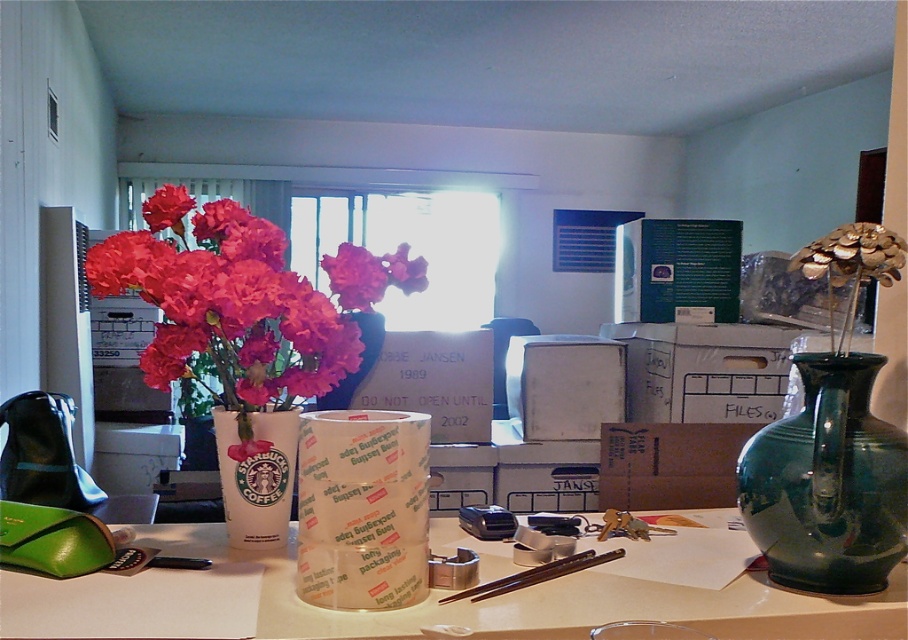
You are standing in the storage room and looking at the table with the white Starbucks coffee cup filled with pink carnations. There is also a matte ceramic vase somewhere on the table. Can you tell me where the point at coordinates (230, 314) is located relative to the objects on the table?

The point at coordinates (230, 314) is located on the matte ceramic vase at upper left.

You are organizing a floral arrangement and need to place the pink matte flower at center into a container. The matte ceramic vase at upper left is available. Will the flower fit inside the vase?

The matte ceramic vase at upper left is much taller than the pink matte flower at center, so the flower will fit inside the vase.

You are organizing a floral arrangement display in the storage room. You have two options to place next to each other on a narrow shelf. Which one should you choose between the matte plastic flowers at center and the matte pink flower at upper left to ensure they both fit without overlapping?

The matte plastic flowers at center has a smaller width compared to the matte pink flower at upper left. Therefore, placing the matte plastic flowers at center next to the matte pink flower at upper left would allow both to fit on the narrow shelf without overlapping since the total width would be the sum of their individual widths, but since the question only asks to choose between them, the matte plastic flowers at center is narrower and thus better for fitting alongside another item.